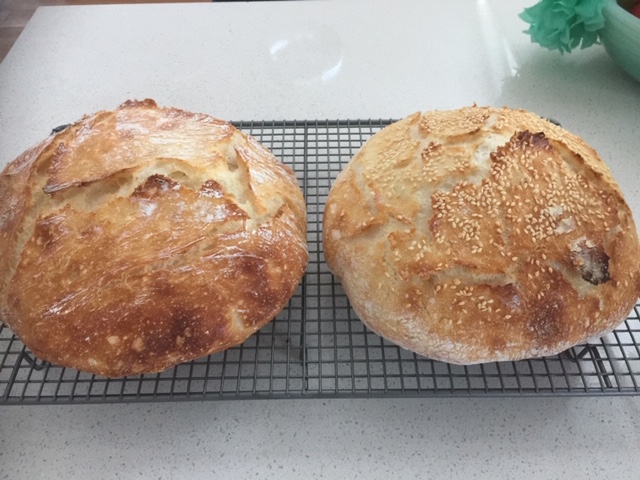
Find the location of a particular element. This screenshot has height=480, width=640. plant is located at coordinates (556, 26).